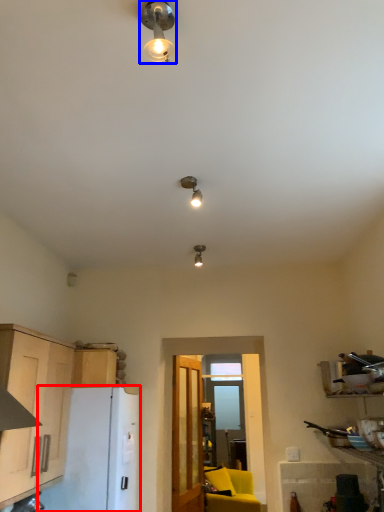
Question: Among these objects, which one is nearest to the camera, appliance (highlighted by a red box) or lamp (highlighted by a blue box)?

Choices:
 (A) appliance
 (B) lamp

Answer: (B)